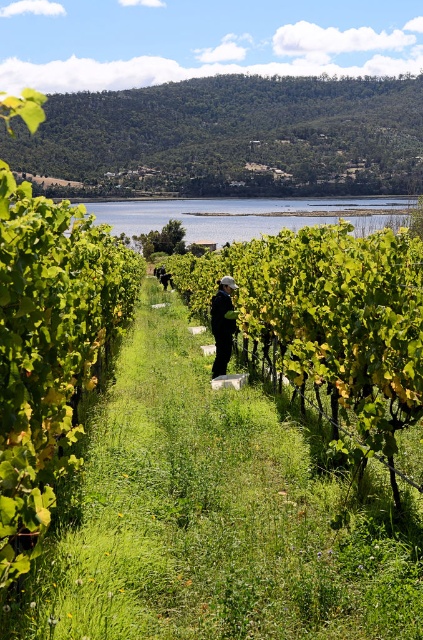
You are standing in the vineyard and see two points marked in the scene. Which point, point (217, 221) or point (214, 294), is closer to you?

Point (217, 221) is closer to you because it is further to the viewer than point (214, 294).

You are a worker in the vineyard and need to cross the grassy path between the rows of grapevines. There is a clear water at center and a dark green fabric at center in your way. Which object is taller and must be stepped over?

The clear water at center is taller than the dark green fabric at center, so you must step over the clear water at center.